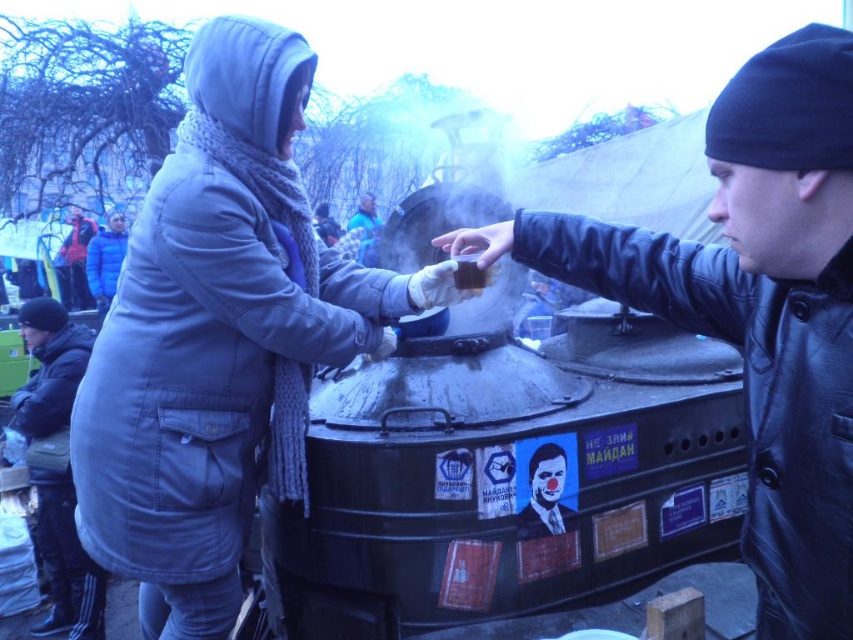
You are a fashion designer observing two coats in an outdoor scene. The scene shows a matte gray coat at center and a black leather jacket at center. Which coat is taller?

The matte gray coat at center is taller than the black leather jacket at center.